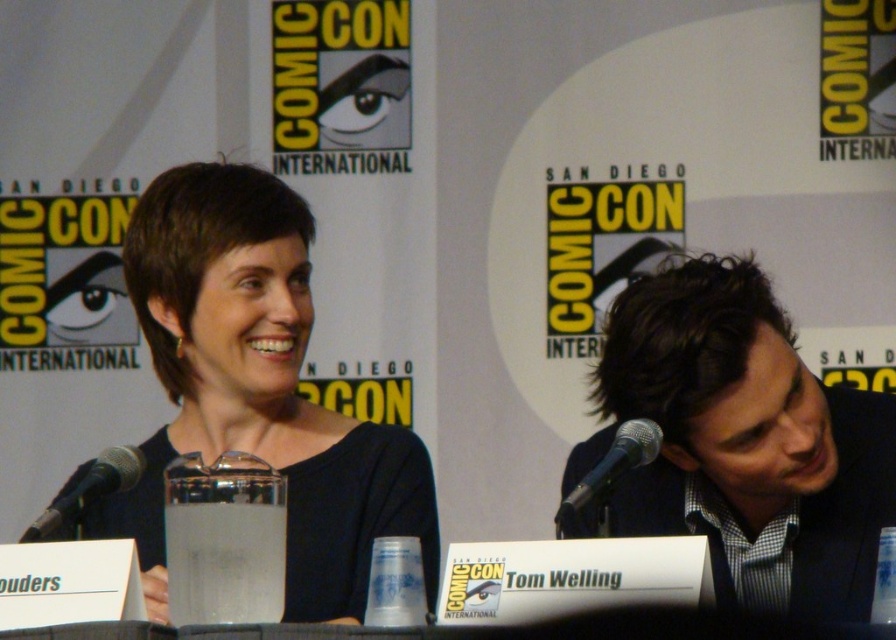
Question: Which is nearer to the black matte dress at center?

Choices:
 (A) black matte microphone at left
 (B) black textured suit at right

Answer: (A)

Question: Does black textured suit at right appear on the left side of black metallic microphone at center?

Choices:
 (A) yes
 (B) no

Answer: (B)

Question: Is black matte dress at center in front of black matte microphone at left?

Choices:
 (A) yes
 (B) no

Answer: (B)

Question: Which point is farther to the camera?

Choices:
 (A) black matte microphone at left
 (B) black textured suit at right
 (C) black matte dress at center
 (D) black metallic microphone at center

Answer: (C)

Question: Does black metallic microphone at center appear on the right side of black matte microphone at left?

Choices:
 (A) yes
 (B) no

Answer: (A)

Question: Which of these objects is positioned closest to the black matte dress at center?

Choices:
 (A) black textured suit at right
 (B) black matte microphone at left
 (C) black metallic microphone at center

Answer: (B)